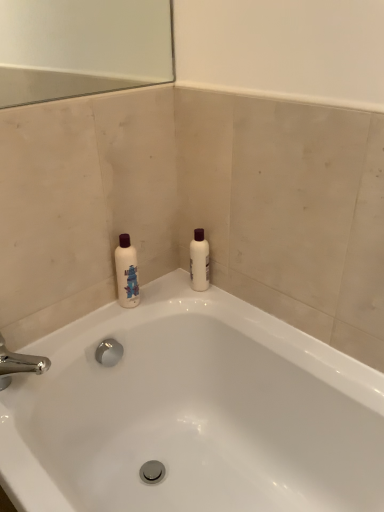
Question: Is white glossy bathtub at upper center spatially inside white matte bottle at upper right, or outside of it?

Choices:
 (A) inside
 (B) outside

Answer: (B)

Question: Visually, is white glossy bathtub at upper center positioned to the left or to the right of white matte bottle at upper right?

Choices:
 (A) right
 (B) left

Answer: (B)

Question: Considering the positions of white glossy bathtub at upper center and white matte bottle at upper right in the image, is white glossy bathtub at upper center bigger or smaller than white matte bottle at upper right?

Choices:
 (A) big
 (B) small

Answer: (A)

Question: In the image, is white matte bottle at upper right on the left side or the right side of white glossy bathtub at upper center?

Choices:
 (A) right
 (B) left

Answer: (A)

Question: Is white matte bottle at upper right in front of or behind white glossy bathtub at upper center in the image?

Choices:
 (A) front
 (B) behind

Answer: (B)

Question: From the image's perspective, is white matte bottle at upper right located above or below white glossy bathtub at upper center?

Choices:
 (A) above
 (B) below

Answer: (A)

Question: From a real-world perspective, relative to white glossy bathtub at upper center, is white matte bottle at upper right vertically above or below?

Choices:
 (A) above
 (B) below

Answer: (A)